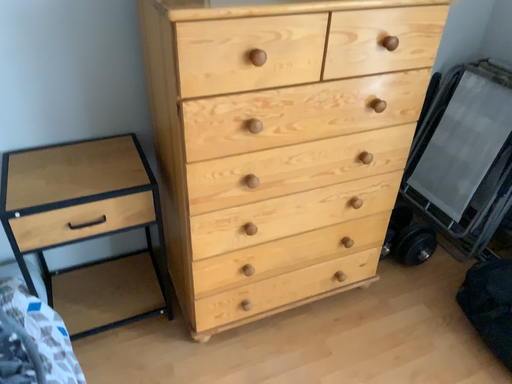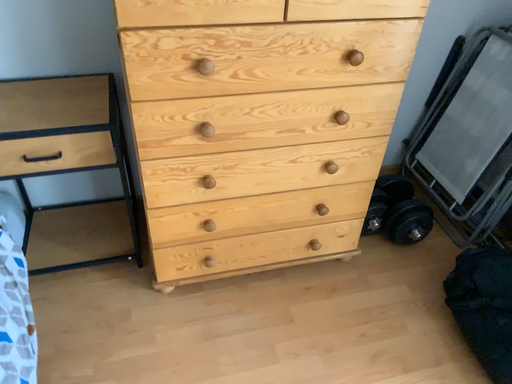
Question: Which way did the camera rotate in the video?

Choices:
 (A) rotated right
 (B) rotated left

Answer: (B)